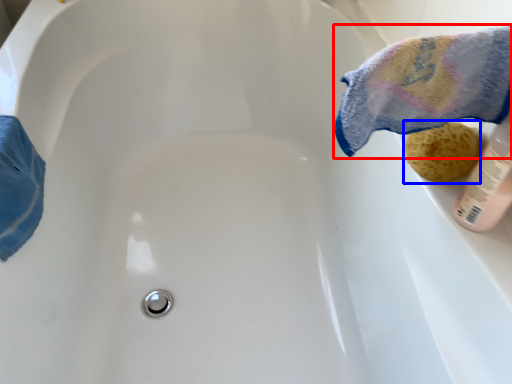
Question: Which of the following is the closest to the observer, bath towel (highlighted by a red box) or stuff (highlighted by a blue box)?

Choices:
 (A) bath towel
 (B) stuff

Answer: (A)